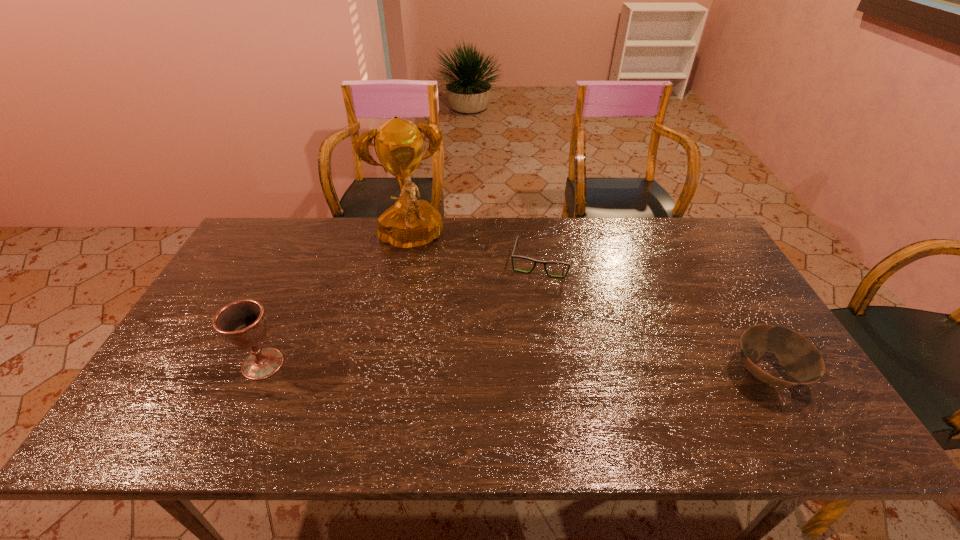
Locate an element on the screen. This screenshot has width=960, height=540. the leftmost object is located at coordinates (243, 324).

In order to click on the third shortest object in this screenshot , I will do `click(243, 324)`.

Find the location of a particular element. This screenshot has height=540, width=960. the rightmost object is located at coordinates (799, 357).

Where is `bowl`? The image size is (960, 540). bowl is located at coordinates (799, 357).

Where is `award`? This screenshot has width=960, height=540. award is located at coordinates (410, 224).

This screenshot has width=960, height=540. I want to click on the second object from left to right, so click(410, 224).

You are a GUI agent. You are given a task and a screenshot of the screen. Output one action in this format:
    pyautogui.click(x=<x>, y=<y>)
    Task: Click on the spectacles
    Image resolution: width=960 pixels, height=540 pixels.
    Given the screenshot: What is the action you would take?
    pyautogui.click(x=513, y=256)

Locate an element on the screen. The width and height of the screenshot is (960, 540). the second object from right to left is located at coordinates (513, 256).

Locate an element on the screen. The width and height of the screenshot is (960, 540). free point located on the right of the chalice is located at coordinates (372, 364).

What are the coordinates of `vacant area situated on the back of the rightmost object` in the screenshot? It's located at (708, 275).